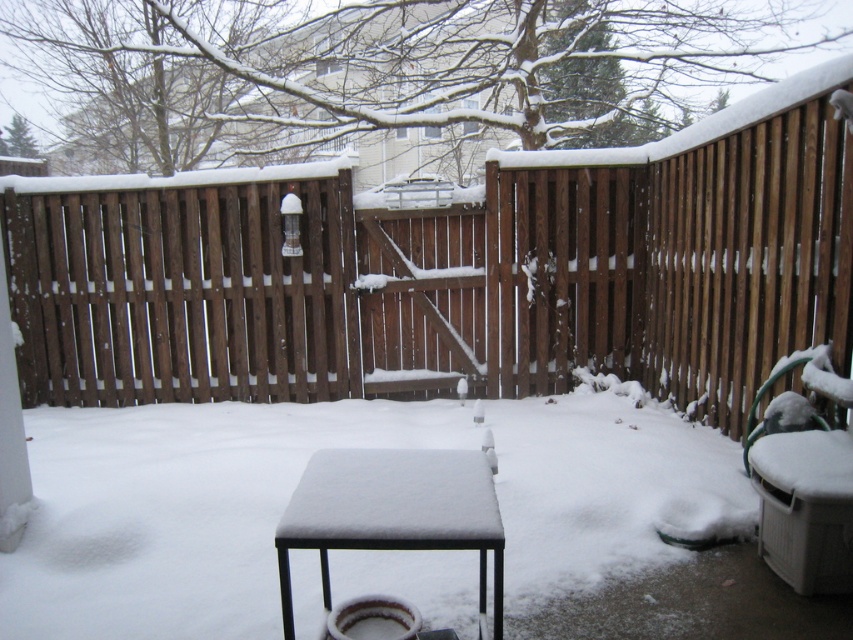
Question: Is snow-covered metal picnic table at center above white plastic chair at right?

Choices:
 (A) yes
 (B) no

Answer: (B)

Question: Among these objects, which one is nearest to the camera?

Choices:
 (A) snow-covered metal picnic table at center
 (B) brown wooden fence at center
 (C) white plastic chair at right

Answer: (A)

Question: Which of these objects is positioned farthest from the snow-covered metal picnic table at center?

Choices:
 (A) brown wooden fence at center
 (B) white plastic chair at right

Answer: (A)

Question: Among these points, which one is nearest to the camera?

Choices:
 (A) (231, 369)
 (B) (474, 451)

Answer: (B)

Question: Can you confirm if brown wooden fence at center is positioned below white plastic chair at right?

Choices:
 (A) no
 (B) yes

Answer: (A)

Question: Is brown wooden fence at center positioned behind snow-covered metal picnic table at center?

Choices:
 (A) yes
 (B) no

Answer: (A)